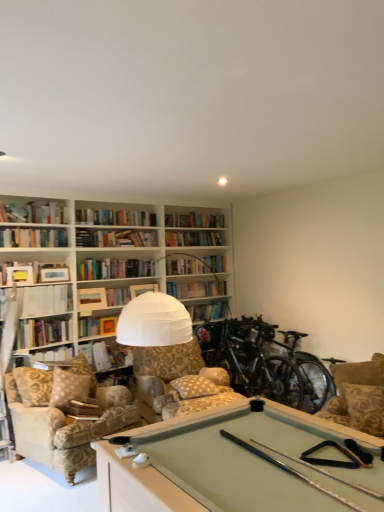
Question: Does hardcover book at center, the 2th book positioned from the top, have a lesser height compared to patterned fabric armchair at right?

Choices:
 (A) no
 (B) yes

Answer: (B)

Question: From the image's perspective, is hardcover book at center, the first book positioned from the right, above patterned fabric armchair at right?

Choices:
 (A) no
 (B) yes

Answer: (A)

Question: Is hardcover book at center, the first book positioned from the right, in front of patterned fabric armchair at right?

Choices:
 (A) yes
 (B) no

Answer: (B)

Question: Is hardcover book at center, the 2th book positioned from the top, oriented towards patterned fabric armchair at right?

Choices:
 (A) yes
 (B) no

Answer: (A)

Question: Is patterned fabric armchair at right completely or partially inside hardcover book at center, the first book positioned from the right?

Choices:
 (A) no
 (B) yes

Answer: (A)

Question: In terms of width, does patterned fabric armchair at right look wider or thinner when compared to white dotted fabric pillow at center?

Choices:
 (A) wide
 (B) thin

Answer: (A)

Question: From the image's perspective, is patterned fabric armchair at right located above or below white dotted fabric pillow at center?

Choices:
 (A) above
 (B) below

Answer: (A)

Question: Is patterned fabric armchair at right bigger or smaller than white dotted fabric pillow at center?

Choices:
 (A) small
 (B) big

Answer: (B)

Question: In terms of height, does patterned fabric armchair at right look taller or shorter compared to white dotted fabric pillow at center?

Choices:
 (A) short
 (B) tall

Answer: (B)

Question: Is hardcover book at center, the 2th book positioned from the top, spatially inside white paper at upper left, which is the 1th book in top-to-bottom order, or outside of it?

Choices:
 (A) outside
 (B) inside

Answer: (A)

Question: From their relative heights in the image, would you say hardcover book at center, the first book positioned from the right, is taller or shorter than white paper at upper left, which is the 2th book from bottom to top?

Choices:
 (A) short
 (B) tall

Answer: (B)

Question: Considering the relative positions of hardcover book at center, the first book positioned from the right, and white paper at upper left, the 1th book viewed from the left, in the image provided, is hardcover book at center, the first book positioned from the right, to the left or to the right of white paper at upper left, the 1th book viewed from the left,?

Choices:
 (A) right
 (B) left

Answer: (A)

Question: Is point (102, 369) closer or farther from the camera than point (51, 312)?

Choices:
 (A) farther
 (B) closer

Answer: (A)

Question: Relative to velvet beige armchair at lower left, is white paper at upper left, the 1th book viewed from the left, in front or behind?

Choices:
 (A) front
 (B) behind

Answer: (B)

Question: Considering the positions of point (64, 300) and point (13, 390), is point (64, 300) closer or farther from the camera than point (13, 390)?

Choices:
 (A) closer
 (B) farther

Answer: (B)